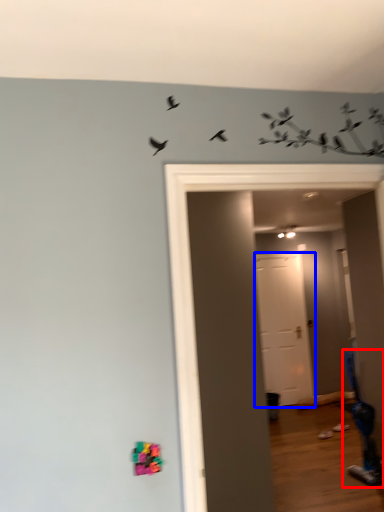
Question: Which object is further to the camera taking this photo, swivel chair (highlighted by a red box) or door (highlighted by a blue box)?

Choices:
 (A) swivel chair
 (B) door

Answer: (B)